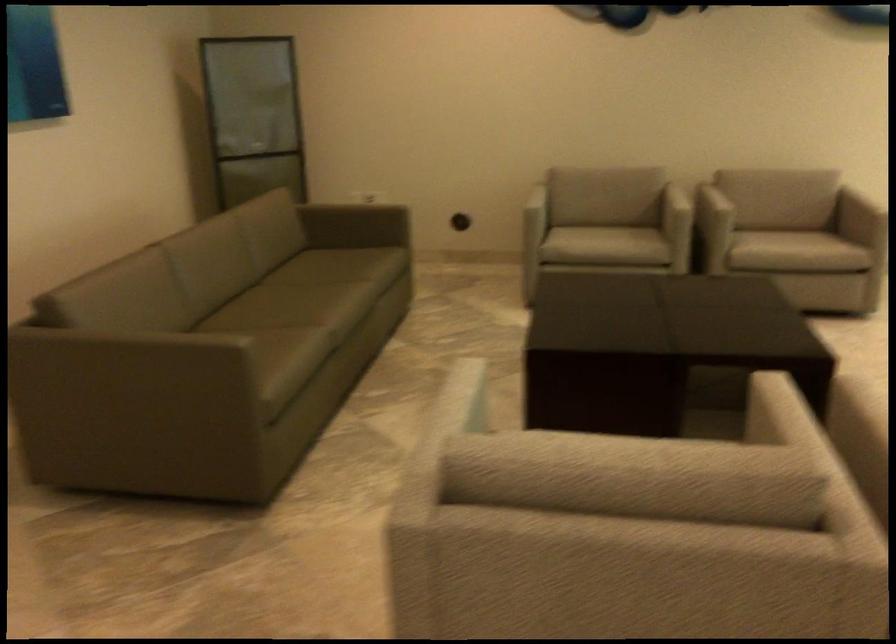
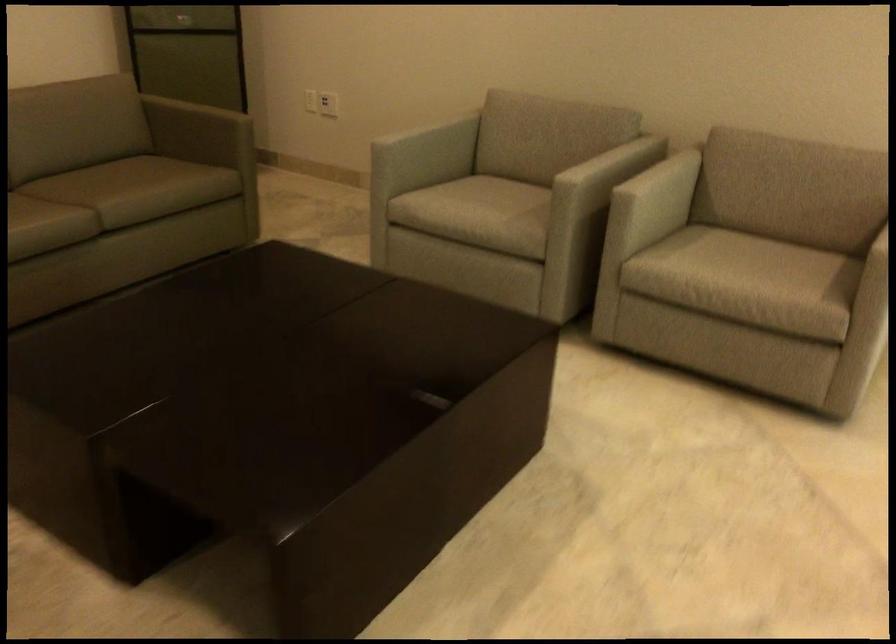
The point at (530,191) is marked in the first image. Where is the corresponding point in the second image?

(423, 127)